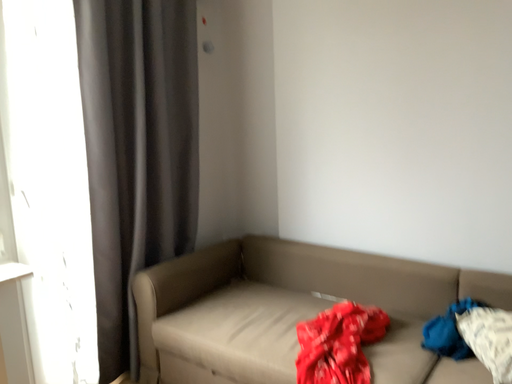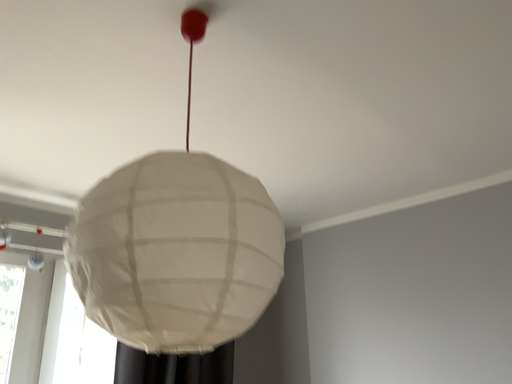
Question: How did the camera likely rotate when shooting the video?

Choices:
 (A) rotated left
 (B) rotated right

Answer: (A)